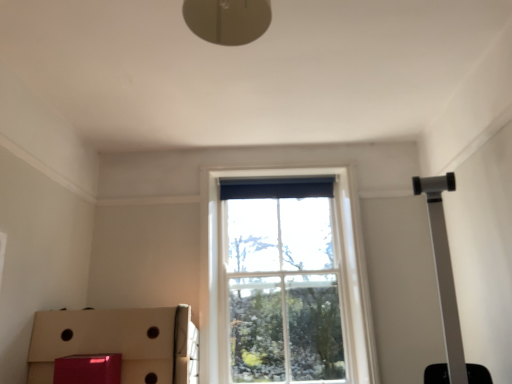
This screenshot has height=384, width=512. Identify the location of cardboard box at lower left. point(119,342).

What do you see at coordinates (119, 342) in the screenshot?
I see `cardboard box at lower left` at bounding box center [119, 342].

Where is `clear glass window at center`? The width and height of the screenshot is (512, 384). clear glass window at center is located at coordinates (284, 282).

Describe the element at coordinates (284, 282) in the screenshot. I see `clear glass window at center` at that location.

Image resolution: width=512 pixels, height=384 pixels. Identify the location of cardboard box at lower left. (119, 342).

Considering the positions of objects clear glass window at center and cardboard box at lower left in the image provided, who is more to the right, clear glass window at center or cardboard box at lower left?

From the viewer's perspective, clear glass window at center appears more on the right side.

Consider the image. Does clear glass window at center lie behind cardboard box at lower left?

Yes, clear glass window at center is further from the camera.

Does point (298, 333) come farther from viewer compared to point (175, 379)?

That is True.

From the image's perspective, is clear glass window at center below cardboard box at lower left?

Incorrect, from the image's perspective, clear glass window at center is higher than cardboard box at lower left.

From a real-world perspective, between clear glass window at center and cardboard box at lower left, who is vertically higher?

From a 3D spatial view, clear glass window at center is above.

Is clear glass window at center thinner than cardboard box at lower left?

Indeed, clear glass window at center has a lesser width compared to cardboard box at lower left.

Based on the photo, between clear glass window at center and cardboard box at lower left, which one has more height?

clear glass window at center is taller.

Between clear glass window at center and cardboard box at lower left, which one has larger size?

cardboard box at lower left.

Can we say clear glass window at center lies outside cardboard box at lower left?

Absolutely, clear glass window at center is external to cardboard box at lower left.

Is clear glass window at center beside cardboard box at lower left?

No, clear glass window at center is not touching cardboard box at lower left.

Is clear glass window at center turned away from cardboard box at lower left?

No, clear glass window at center is not facing the opposite direction of cardboard box at lower left.

Measure the distance from clear glass window at center to cardboard box at lower left.

They are 38.85 inches apart.

Where is `cardboard box below the clear glass window at center (from the image's perspective)`? The height and width of the screenshot is (384, 512). cardboard box below the clear glass window at center (from the image's perspective) is located at coordinates (119, 342).

Which is more to the right, cardboard box at lower left or clear glass window at center?

From the viewer's perspective, clear glass window at center appears more on the right side.

Which is behind, cardboard box at lower left or clear glass window at center?

Positioned behind is clear glass window at center.

Does point (66, 349) come behind point (314, 282)?

That is False.

From the image's perspective, is cardboard box at lower left above or below clear glass window at center?

cardboard box at lower left is situated lower than clear glass window at center in the image.

From a real-world perspective, is cardboard box at lower left on top of clear glass window at center?

Actually, cardboard box at lower left is physically below clear glass window at center in the real world.

Can you confirm if cardboard box at lower left is thinner than clear glass window at center?

In fact, cardboard box at lower left might be wider than clear glass window at center.

In terms of height, does cardboard box at lower left look taller or shorter compared to clear glass window at center?

Considering their sizes, cardboard box at lower left has less height than clear glass window at center.

Who is smaller, cardboard box at lower left or clear glass window at center?

With smaller size is clear glass window at center.

Is clear glass window at center a part of cardboard box at lower left?

No, cardboard box at lower left does not contain clear glass window at center.

Is cardboard box at lower left far from clear glass window at center?

No, cardboard box at lower left is not far away from clear glass window at center.

Is cardboard box at lower left facing towards clear glass window at center?

No, cardboard box at lower left is not aimed at clear glass window at center.

How far apart are cardboard box at lower left and clear glass window at center?

A distance of 38.85 inches exists between cardboard box at lower left and clear glass window at center.

The width and height of the screenshot is (512, 384). What are the coordinates of `cardboard box below the clear glass window at center (from a real-world perspective)` in the screenshot? It's located at (119, 342).

The height and width of the screenshot is (384, 512). I want to click on cardboard box in front of the clear glass window at center, so click(119, 342).

Image resolution: width=512 pixels, height=384 pixels. Identify the location of window behind the cardboard box at lower left. (284, 282).